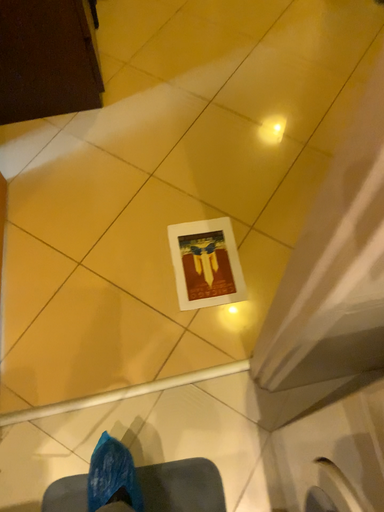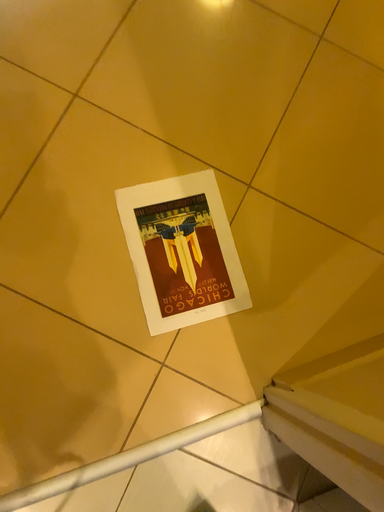
Question: Which way did the camera rotate in the video?

Choices:
 (A) rotated left
 (B) rotated right

Answer: (B)